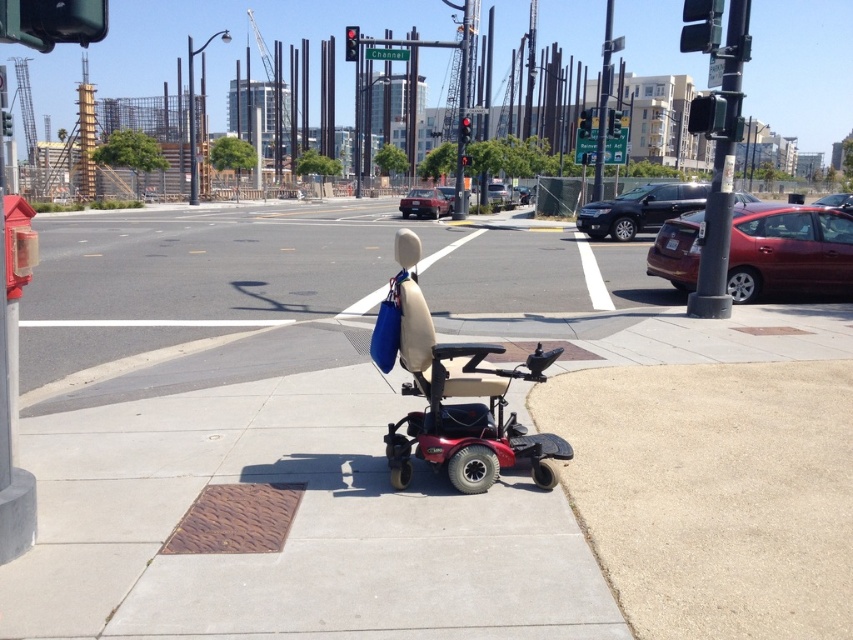
Question: Is red plastic wheelchair at center above shiny red sedan at right?

Choices:
 (A) no
 (B) yes

Answer: (A)

Question: Which point is closer to the camera taking this photo?

Choices:
 (A) (589, 116)
 (B) (407, 200)
 (C) (96, 36)

Answer: (C)

Question: Which of these objects is positioned farthest from the red plastic traffic light at center?

Choices:
 (A) red plastic wheelchair at center
 (B) metallic green traffic light at upper left

Answer: (B)

Question: Which point is closer to the camera?

Choices:
 (A) (467, 131)
 (B) (432, 212)
 (C) (833, 212)
 (D) (845, 211)

Answer: (C)

Question: Can you confirm if metallic green traffic light at upper left is smaller than shiny red sedan at right?

Choices:
 (A) yes
 (B) no

Answer: (A)

Question: Is metallic traffic light at upper center smaller than red plastic traffic light at center?

Choices:
 (A) no
 (B) yes

Answer: (A)